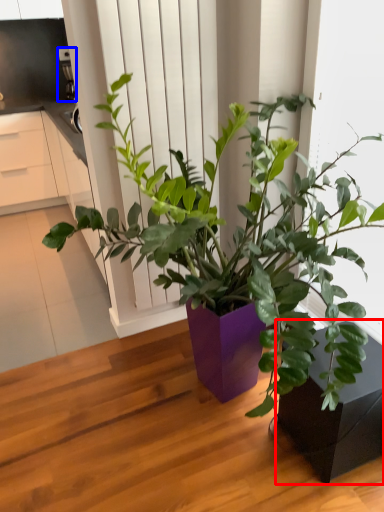
Question: Which object appears farthest to the camera in this image, flowerpot (highlighted by a red box) or appliance (highlighted by a blue box)?

Choices:
 (A) flowerpot
 (B) appliance

Answer: (B)